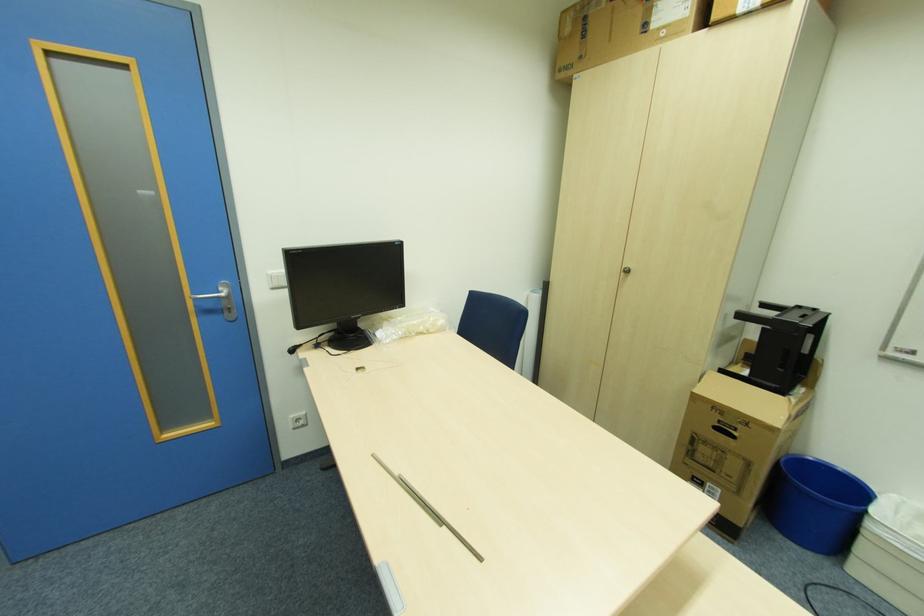
At what (x,y) coordinates should I click in order to perform the action: click on silver door handle. Please return your answer as a coordinate pair (x, y). Looking at the image, I should click on (222, 300).